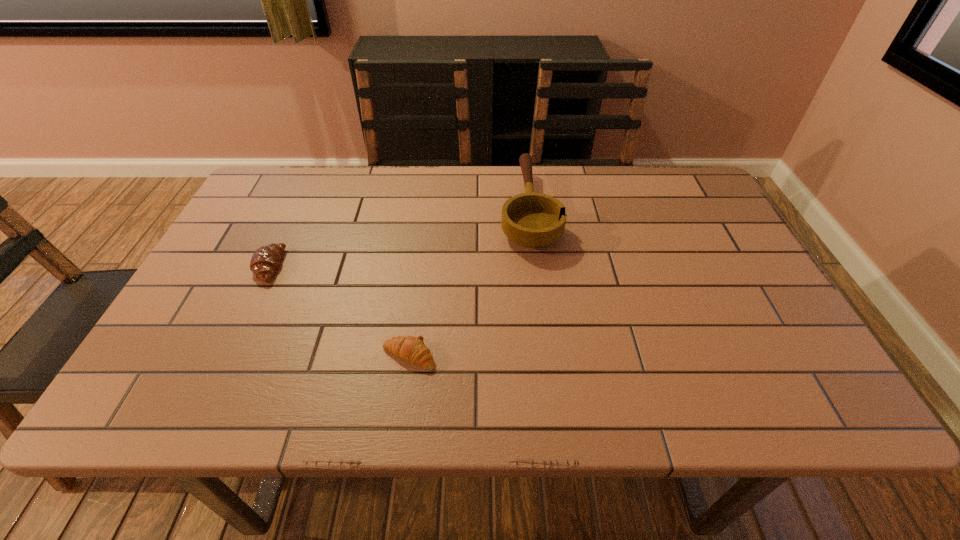
This screenshot has width=960, height=540. What are the coordinates of `saucepan` in the screenshot? It's located at (533, 220).

You are a GUI agent. You are given a task and a screenshot of the screen. Output one action in this format:
    pyautogui.click(x=<x>, y=<y>)
    Task: Click on the tallest object
    The width and height of the screenshot is (960, 540).
    Given the screenshot: What is the action you would take?
    pyautogui.click(x=533, y=220)

Where is `the second shortest object`? the second shortest object is located at coordinates (265, 260).

Locate an element on the screen. the farther crescent roll is located at coordinates (265, 260).

Identify the location of the shorter crescent roll. (412, 349).

Image resolution: width=960 pixels, height=540 pixels. I want to click on the nearer crescent roll, so click(x=412, y=349).

Find the location of a particular element. This screenshot has width=960, height=540. free location located on the front of the taller crescent roll is located at coordinates (199, 413).

Where is `free spot located on the left of the nearer crescent roll`? The height and width of the screenshot is (540, 960). free spot located on the left of the nearer crescent roll is located at coordinates (244, 356).

The height and width of the screenshot is (540, 960). Identify the location of object at the far edge. (533, 220).

Where is `object at the left edge`? object at the left edge is located at coordinates (265, 260).